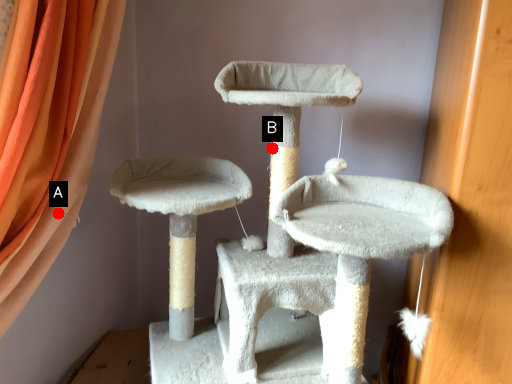
Question: Two points are circled on the image, labeled by A and B beside each circle. Which point is further to the camera?

Choices:
 (A) A is further
 (B) B is further

Answer: (B)